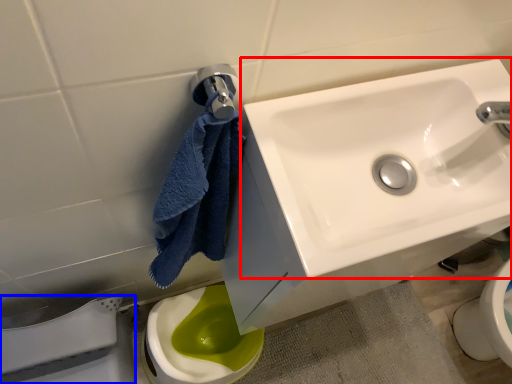
Question: Among these objects, which one is nearest to the camera, sink (highlighted by a red box) or porcelain (highlighted by a blue box)?

Choices:
 (A) sink
 (B) porcelain

Answer: (A)